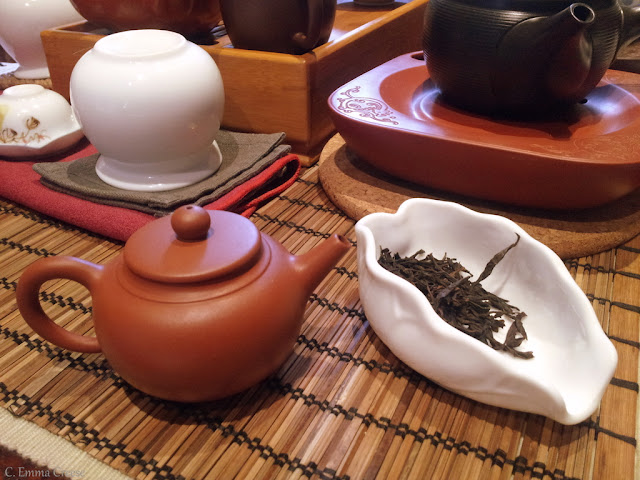
I want to click on pot handles, so click(70, 265), click(605, 49), click(315, 19), click(200, 9).